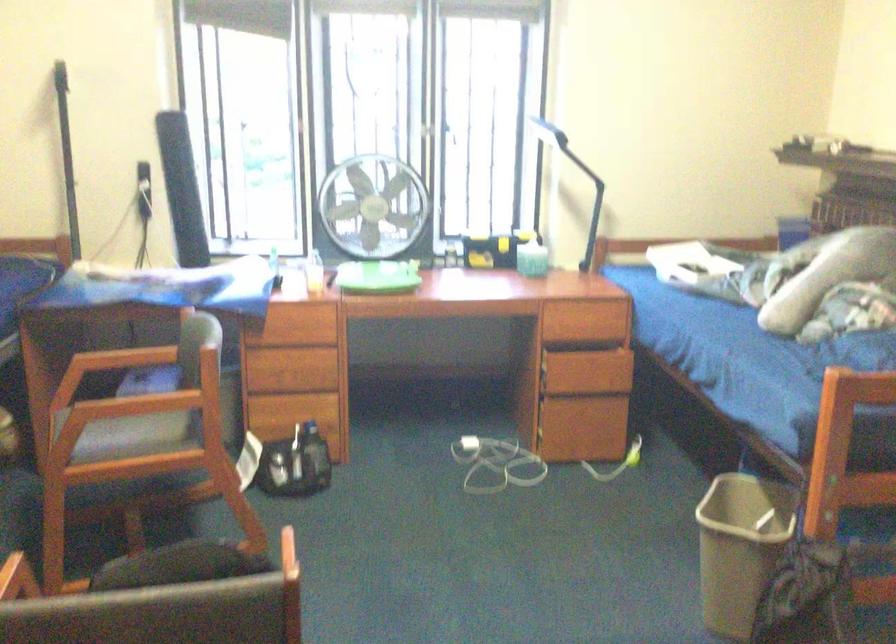
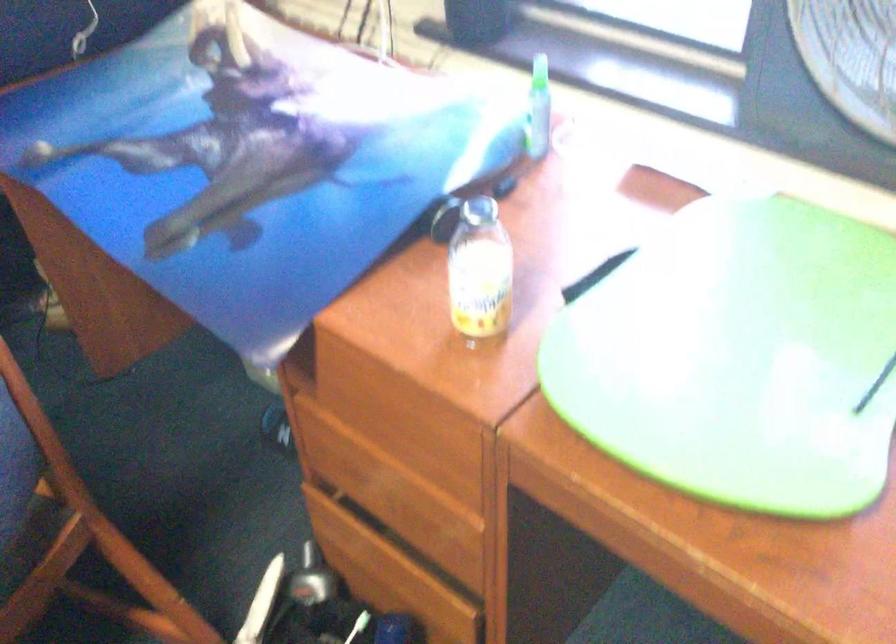
Where in the second image is the point corresponding to (x=305, y=275) from the first image?

(479, 270)